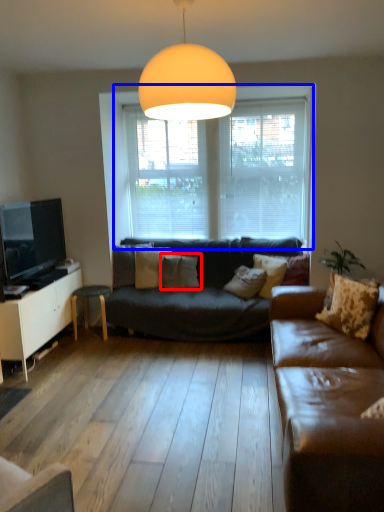
Question: Which point is further to the camera, pillow (highlighted by a red box) or window (highlighted by a blue box)?

Choices:
 (A) pillow
 (B) window

Answer: (B)